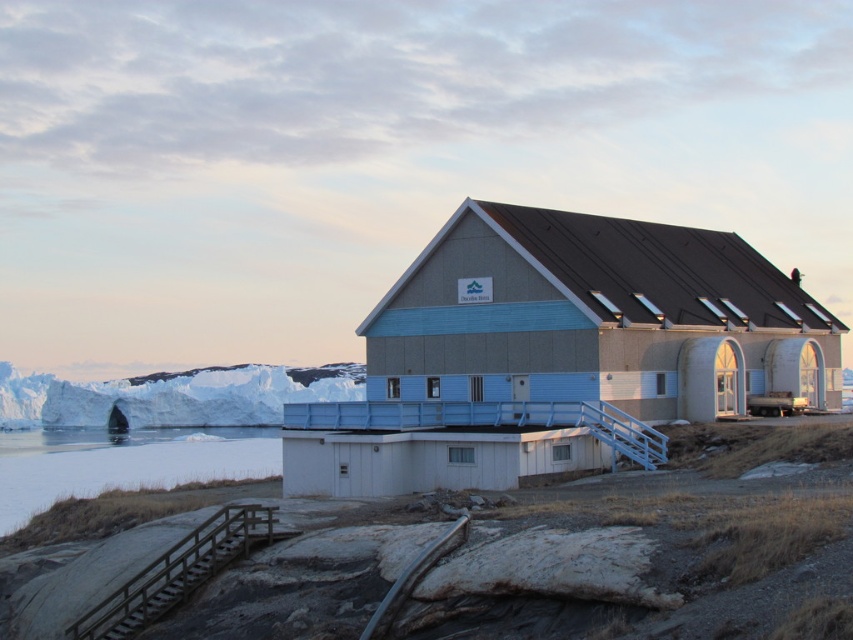
Question: Which point is farther to the camera?

Choices:
 (A) (136, 609)
 (B) (413, 419)

Answer: (B)

Question: Which point is farther to the camera?

Choices:
 (A) (260, 397)
 (B) (572, 384)

Answer: (A)

Question: Which of the following is the closest to the observer?

Choices:
 (A) metallic silver rail at lower center
 (B) blue painted wood hut at center
 (C) white ice at left

Answer: (A)

Question: Is blue painted wood hut at center below white ice at left?

Choices:
 (A) no
 (B) yes

Answer: (A)

Question: Is blue painted wood hut at center below metallic silver rail at lower center?

Choices:
 (A) yes
 (B) no

Answer: (B)

Question: In this image, where is white ice at left located relative to wooden at lower left?

Choices:
 (A) right
 (B) left

Answer: (B)